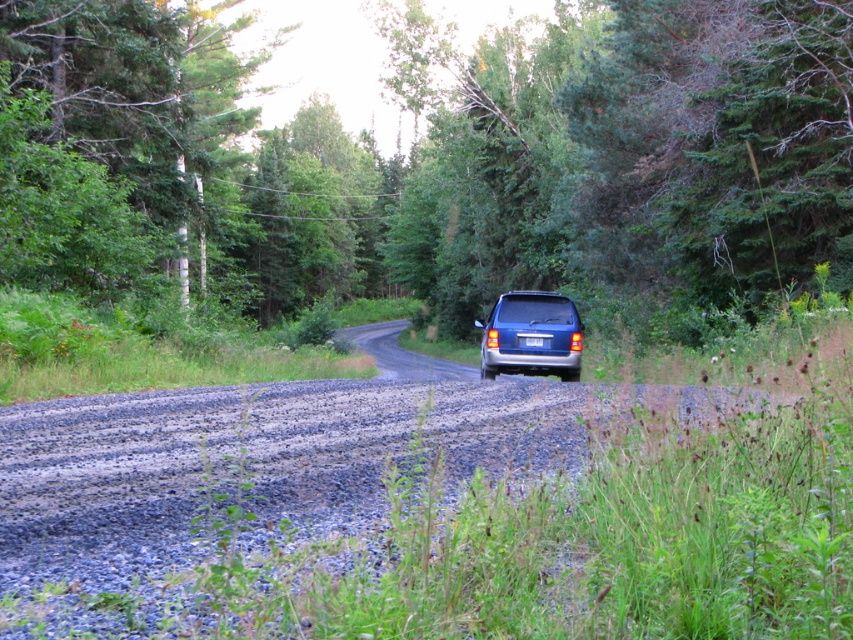
Question: Where is green leafy tree at center located in relation to gray gravel road at center in the image?

Choices:
 (A) left
 (B) right

Answer: (A)

Question: Is satin blue suv at center further to the viewer compared to blue metallic license plate at center?

Choices:
 (A) no
 (B) yes

Answer: (A)

Question: Does green leafy tree at center have a greater width compared to satin blue suv at center?

Choices:
 (A) no
 (B) yes

Answer: (B)

Question: Which object appears closest to the camera in this image?

Choices:
 (A) satin blue suv at center
 (B) green leafy tree at center
 (C) blue metallic license plate at center
 (D) gray gravel road at center

Answer: (D)

Question: Which object appears closest to the camera in this image?

Choices:
 (A) satin blue suv at center
 (B) green leafy tree at center
 (C) blue metallic license plate at center
 (D) gray gravel road at center

Answer: (D)

Question: Which point is closer to the camera?

Choices:
 (A) blue metallic license plate at center
 (B) green leafy tree at center
 (C) satin blue suv at center
 (D) gray gravel road at center

Answer: (D)